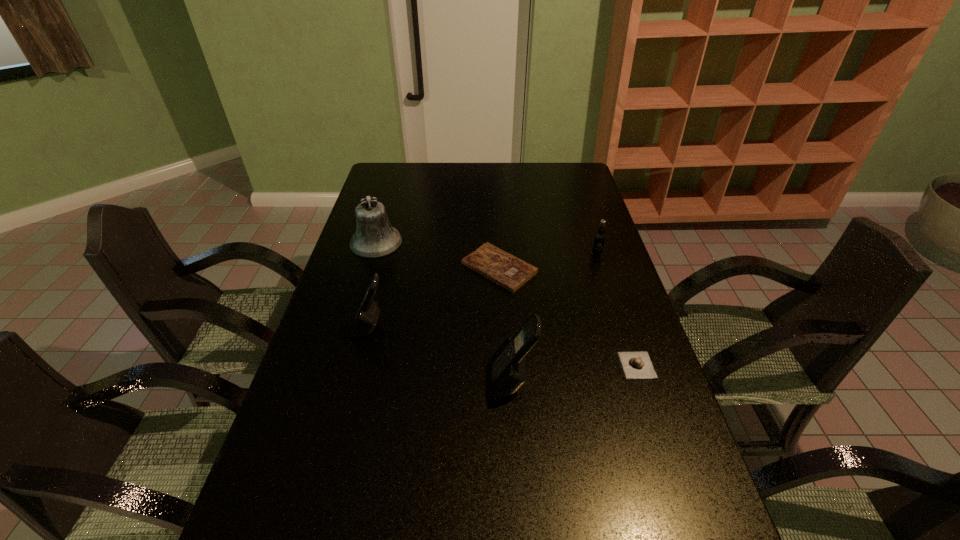
This screenshot has height=540, width=960. Find the location of `unoccupied area between the shortest object and the fifth tallest object`. unoccupied area between the shortest object and the fifth tallest object is located at coordinates (568, 316).

You are a GUI agent. You are given a task and a screenshot of the screen. Output one action in this format:
    pyautogui.click(x=<x>, y=<y>)
    Task: Click on the vacant area between the Bible and the bell
    
    Given the screenshot: What is the action you would take?
    pyautogui.click(x=438, y=255)

At what (x,y) coordinates should I click in order to perform the action: click on empty location between the garlic and the fourth tallest object. Please return your answer as a coordinate pair (x, y). The width and height of the screenshot is (960, 540). Looking at the image, I should click on (616, 309).

Find the location of `object that is the second closest to the Bible`. object that is the second closest to the Bible is located at coordinates (375, 237).

Locate an element on the screen. object that can be found as the fourth closest to the shortest object is located at coordinates (506, 372).

This screenshot has height=540, width=960. In order to click on vacant point that satisfies the following two spatial constraints: 1. on the front side of the shortest object; 2. on the front-facing side of the left cellular telephone in this screenshot , I will do `click(502, 327)`.

Where is `vacant area in the image that satisfies the following two spatial constraints: 1. on the front-facing side of the shorter cellular telephone; 2. on the right side of the second shortest object`? Image resolution: width=960 pixels, height=540 pixels. vacant area in the image that satisfies the following two spatial constraints: 1. on the front-facing side of the shorter cellular telephone; 2. on the right side of the second shortest object is located at coordinates (361, 365).

This screenshot has width=960, height=540. In order to click on vacant space that satisfies the following two spatial constraints: 1. on the label of the third shortest object; 2. on the front-facing side of the taller cellular telephone in this screenshot , I will do `click(638, 383)`.

This screenshot has height=540, width=960. In order to click on vacant space that satisfies the following two spatial constraints: 1. on the label of the third shortest object; 2. on the front-facing side of the right cellular telephone in this screenshot , I will do `click(638, 383)`.